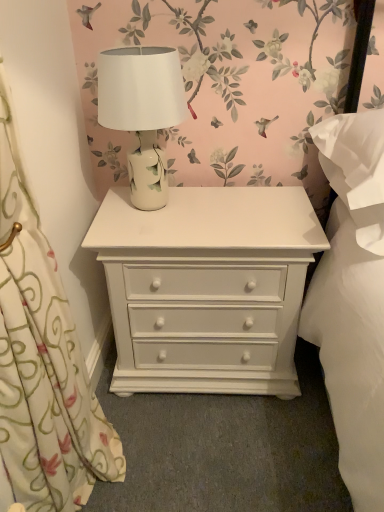
The height and width of the screenshot is (512, 384). Find the location of `vacant area that is situated to the right of white ceramic table lamp at center`. vacant area that is situated to the right of white ceramic table lamp at center is located at coordinates (233, 207).